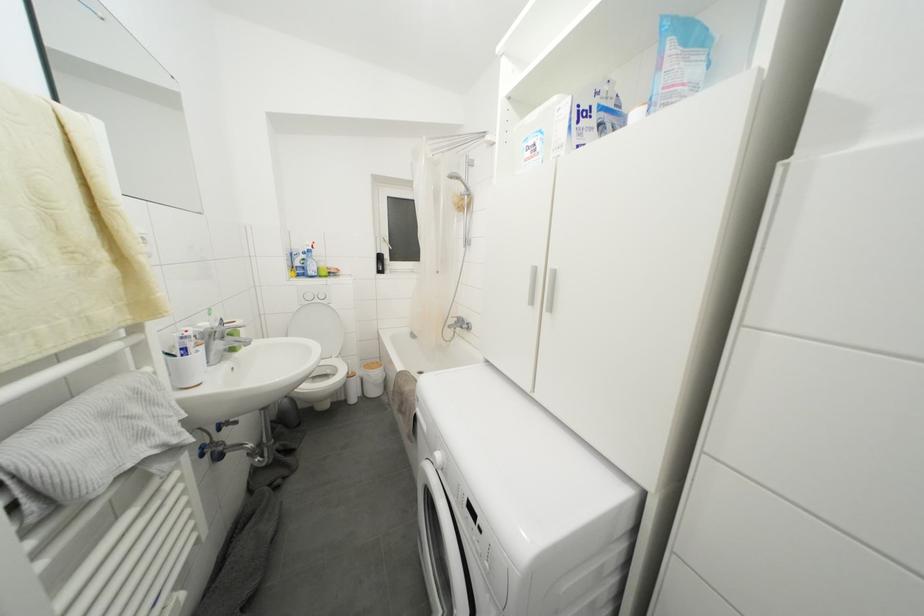
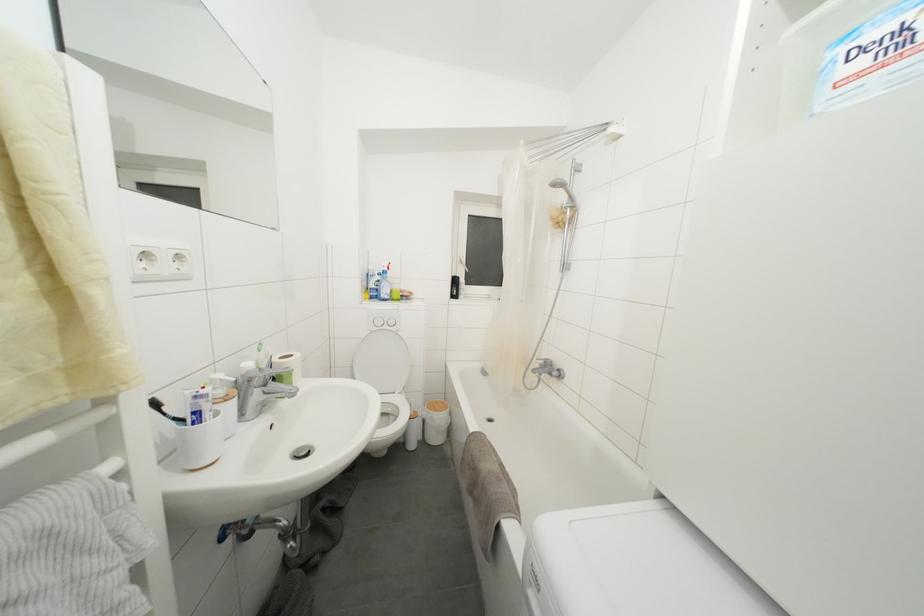
Question: The camera is either moving clockwise (left) or counter-clockwise (right) around the object. The first image is from the beginning of the video and the second image is from the end. Is the camera moving left or right when shooting the video?

Choices:
 (A) Left
 (B) Right

Answer: (B)